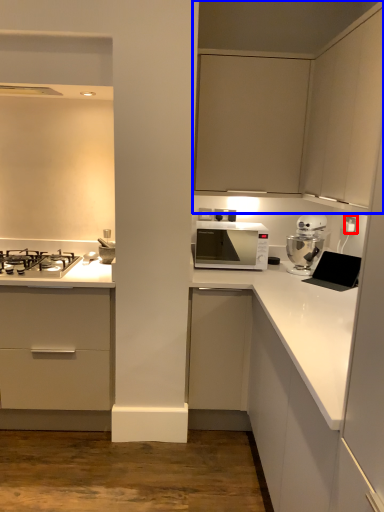
Question: Which point is closer to the camera, electric outlet (highlighted by a red box) or cabinetry (highlighted by a blue box)?

Choices:
 (A) electric outlet
 (B) cabinetry

Answer: (B)